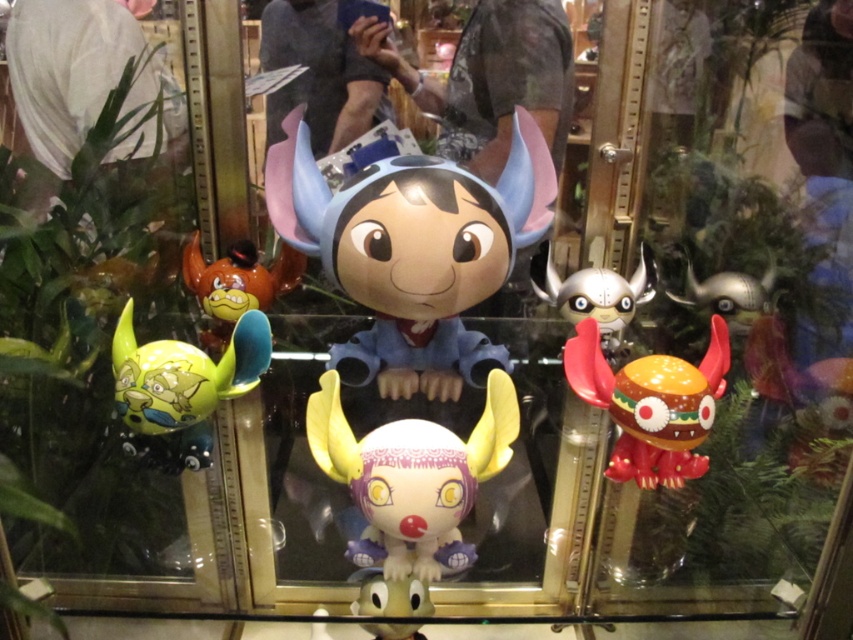
You are a museum security guard and you need to ensure that the white matte plush toy at center and the silver metallic helmet at center are at least 30 centimeters apart for safety. Based on the scene, are they positioned safely?

The white matte plush toy at center is 34.43 centimeters away from the silver metallic helmet at center, which exceeds the required 30 centimeter safety distance. Therefore, they are positioned safely.

You are a customer in a store looking at the glass case with the white matte plush toy at center and the silver metallic helmet at center. Which object is positioned lower in the display?

The white matte plush toy at center is located below the silver metallic helmet at center, so it is positioned lower in the display.

You are a collector who wants to place a new figurine between the matte plastic figurine at center and the bright red plastic toy at right. Which side should you place it on to maintain the height order?

The matte plastic figurine at center is taller than the bright red plastic toy at right, so placing the new figurine between them would require positioning it closer to the bright red plastic toy at right to maintain the descending height order from the center outward.